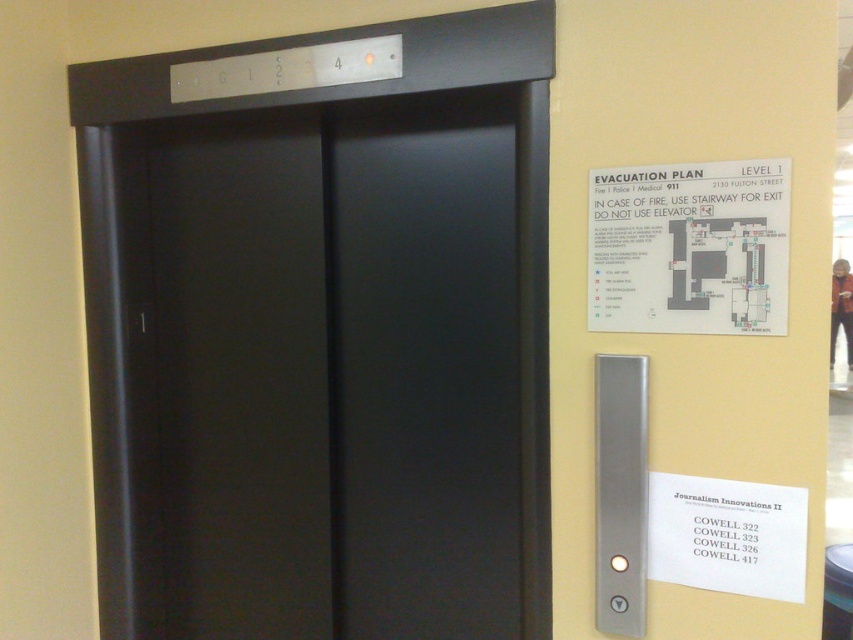
You are standing in front of the elevator and see two points marked on the image. The first point is at coordinates point (227, 541) and the second is at point (457, 92). Which point is closer to you?

Point (227, 541) is closer to you because it is further to the viewer than point (457, 92).

You are standing in front of an elevator and need to determine if you can reach the emergency call button located at point (432, 244). Your arm can extend 1.5 meters. Can you reach it?

The point (432, 244) is 1.87 meters away from you. Since your arm can only extend 1.5 meters, you cannot reach the emergency call button located at point (432, 244).

You are standing in front of the elevator and need to check the evacuation plan on the white paper map at upper right. Can you see the satin black door at center in your line of sight while looking at the map?

Yes, because the satin black door at center is below the white paper map at upper right, so when looking at the map, the door would be in your line of sight below it.